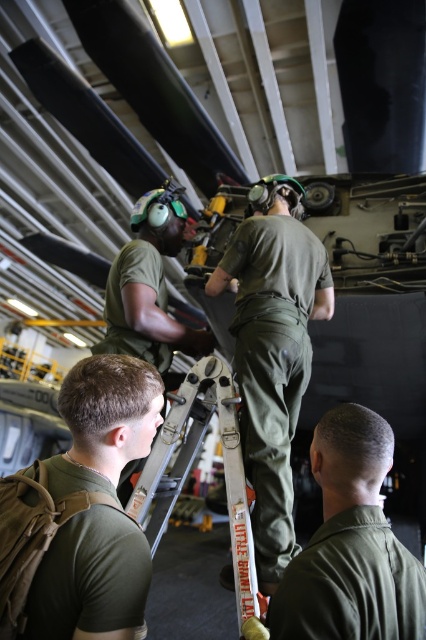
Question: From the image, what is the correct spatial relationship of green matte t-shirt at lower left in relation to white plastic ladder at center?

Choices:
 (A) right
 (B) left

Answer: (B)

Question: Which object appears farthest from the camera in this image?

Choices:
 (A) white plastic ladder at center
 (B) green matte t-shirt at lower left
 (C) green matte uniform at center
 (D) green uniform at center

Answer: (C)

Question: Is green uniform at center positioned behind white plastic ladder at center?

Choices:
 (A) no
 (B) yes

Answer: (A)

Question: Which point is farther from the camera taking this photo?

Choices:
 (A) (138, 332)
 (B) (305, 349)

Answer: (A)

Question: Is green matte t-shirt at lower left below white plastic ladder at center?

Choices:
 (A) no
 (B) yes

Answer: (A)

Question: Which point appears farthest from the camera in this image?

Choices:
 (A) (206, 342)
 (B) (149, 483)
 (C) (291, 595)
 (D) (238, 232)

Answer: (A)